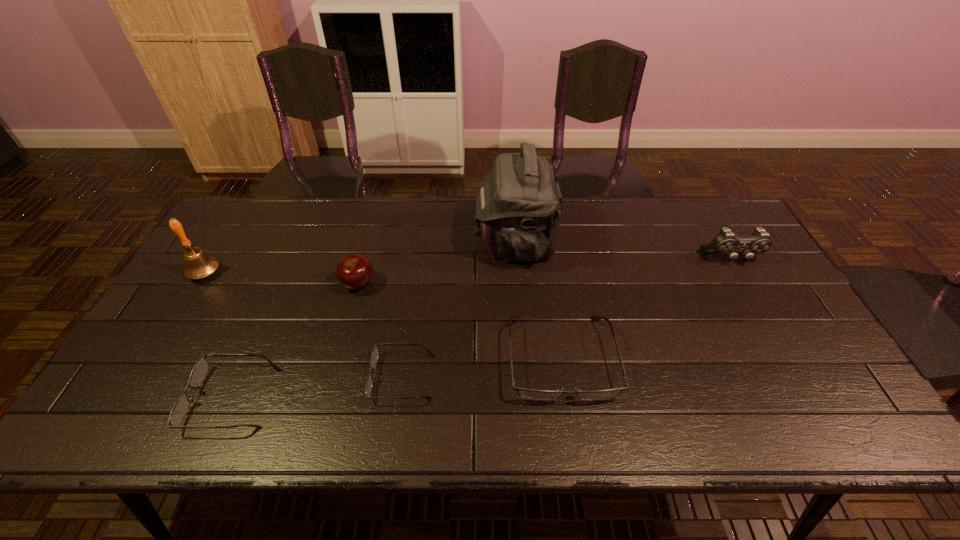
The width and height of the screenshot is (960, 540). In the image, there is a desktop. Identify the location of vacant space at the far left corner. (242, 210).

Image resolution: width=960 pixels, height=540 pixels. I want to click on vacant space at the far right corner of the desktop, so click(716, 198).

Find the location of a particular element. The height and width of the screenshot is (540, 960). vacant space that's between the bell and the third shortest object is located at coordinates (383, 315).

Find the location of a particular element. empty space between the second spectacles from right to left and the tallest object is located at coordinates (459, 309).

Find the location of `vacant region between the shoulder bag and the second tallest spectacles`. vacant region between the shoulder bag and the second tallest spectacles is located at coordinates (373, 320).

I want to click on free space that is in between the fifth object from right to left and the shortest spectacles, so 380,330.

The image size is (960, 540). What are the coordinates of `vacant region between the third shortest object and the shoulder bag` in the screenshot? It's located at (538, 300).

You are a GUI agent. You are given a task and a screenshot of the screen. Output one action in this format:
    pyautogui.click(x=<x>, y=<y>)
    Task: Click on the free space that is in between the fourth object from left to right and the third shortest object
    
    Given the screenshot: What is the action you would take?
    pyautogui.click(x=482, y=367)

Where is `vacant region between the control and the tallest object`? The width and height of the screenshot is (960, 540). vacant region between the control and the tallest object is located at coordinates (623, 251).

Where is `free area in between the fifth object from right to left and the tallest spectacles`? free area in between the fifth object from right to left and the tallest spectacles is located at coordinates (460, 321).